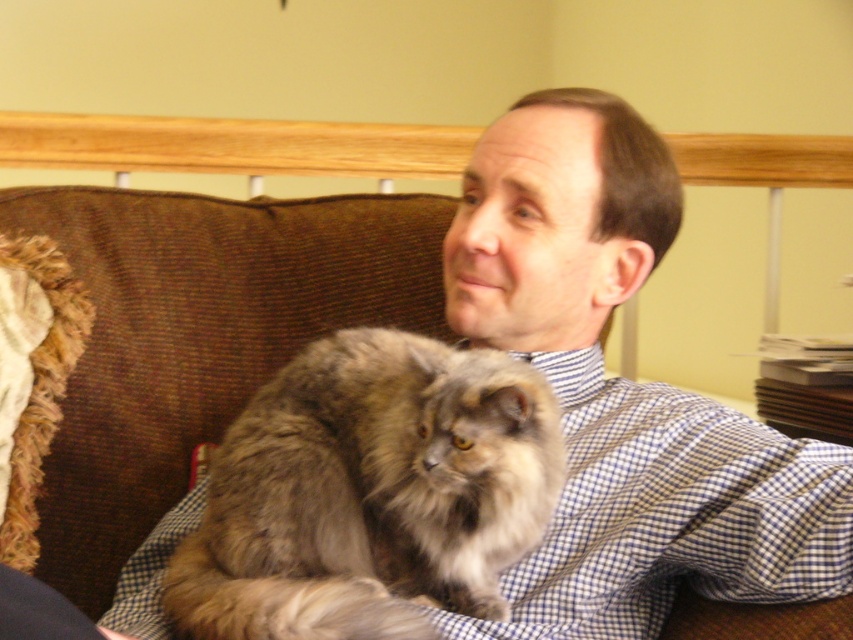
Does brown corduroy couch at upper left lie in front of fuzzy brown cat at center?

No, brown corduroy couch at upper left is further to the viewer.

Which of these two, brown corduroy couch at upper left or fuzzy brown cat at center, stands taller?

brown corduroy couch at upper left is taller.

Between point (338, 221) and point (485, 612), which one is positioned in front?

Positioned in front is point (485, 612).

Locate an element on the screen. The height and width of the screenshot is (640, 853). brown corduroy couch at upper left is located at coordinates (199, 336).